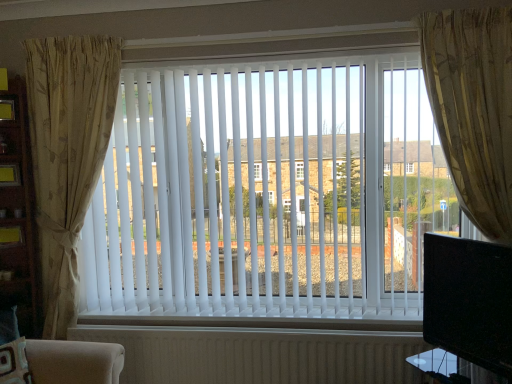
Question: From the image's perspective, would you say white ribbed radiator at bottom is shown under black glossy tv at right?

Choices:
 (A) yes
 (B) no

Answer: (A)

Question: Could you tell me if white ribbed radiator at bottom is turned towards black glossy tv at right?

Choices:
 (A) no
 (B) yes

Answer: (A)

Question: Is white ribbed radiator at bottom shorter than black glossy tv at right?

Choices:
 (A) yes
 (B) no

Answer: (A)

Question: Is black glossy tv at right at the back of white ribbed radiator at bottom?

Choices:
 (A) no
 (B) yes

Answer: (A)

Question: Is white ribbed radiator at bottom outside black glossy tv at right?

Choices:
 (A) no
 (B) yes

Answer: (B)

Question: Based on their sizes in the image, would you say black glossy tv at right is bigger or smaller than white ribbed radiator at bottom?

Choices:
 (A) small
 (B) big

Answer: (A)

Question: Relative to white ribbed radiator at bottom, is black glossy tv at right in front or behind?

Choices:
 (A) front
 (B) behind

Answer: (A)

Question: In terms of width, does black glossy tv at right look wider or thinner when compared to white ribbed radiator at bottom?

Choices:
 (A) thin
 (B) wide

Answer: (B)

Question: Would you say black glossy tv at right is to the left or to the right of white ribbed radiator at bottom in the picture?

Choices:
 (A) left
 (B) right

Answer: (B)

Question: Is beige floral fabric curtain at left, which ranks as the 2th curtain in right-to-left order, inside or outside of white ribbed radiator at bottom?

Choices:
 (A) outside
 (B) inside

Answer: (A)

Question: From a real-world perspective, is beige floral fabric curtain at left, which ranks as the 2th curtain in right-to-left order, positioned above or below white ribbed radiator at bottom?

Choices:
 (A) below
 (B) above

Answer: (B)

Question: In terms of width, does beige floral fabric curtain at left, which ranks as the 2th curtain in right-to-left order, look wider or thinner when compared to white ribbed radiator at bottom?

Choices:
 (A) wide
 (B) thin

Answer: (A)

Question: From the image's perspective, relative to white ribbed radiator at bottom, is beige floral fabric curtain at left, which ranks as the 2th curtain in right-to-left order, above or below?

Choices:
 (A) below
 (B) above

Answer: (B)

Question: From the image's perspective, is beige floral fabric curtain at left, which ranks as the 2th curtain in right-to-left order, located above or below white plastic blinds at center?

Choices:
 (A) below
 (B) above

Answer: (A)

Question: Considering the positions of point (86, 210) and point (175, 150), is point (86, 210) closer or farther from the camera than point (175, 150)?

Choices:
 (A) farther
 (B) closer

Answer: (B)